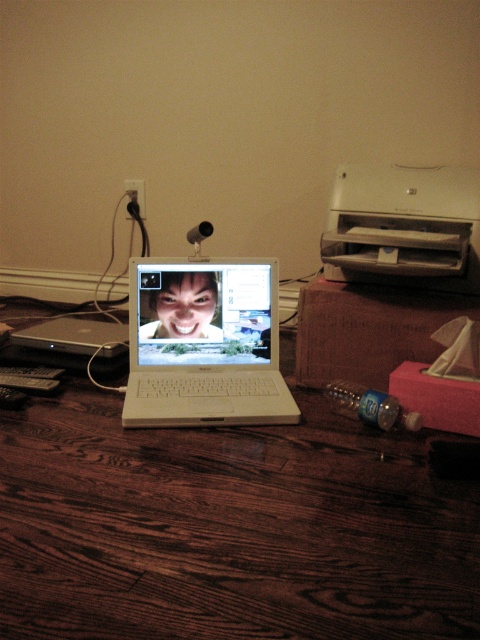
Is point (336, 256) positioned in front of point (216, 330)?

Yes, point (336, 256) is closer to viewer.

Between point (367, 188) and point (250, 280), which one is positioned behind?

The point (367, 188) is behind.

Where is `white plastic printer at upper right`? white plastic printer at upper right is located at coordinates (404, 225).

Who is taller, wooden table at center or shiny white laptop at center?

wooden table at center

Between point (54, 528) and point (225, 314), which one is positioned behind?

Point (225, 314)

Does point (159, 586) lie in front of point (157, 353)?

That is True.

I want to click on wooden table at center, so click(x=228, y=529).

Can you confirm if wooden table at center is wider than white plastic laptop at center?

Indeed, wooden table at center has a greater width compared to white plastic laptop at center.

Is point (381, 618) in front of point (193, 307)?

Yes, point (381, 618) is in front of point (193, 307).

Locate an element on the screen. wooden table at center is located at coordinates (228, 529).